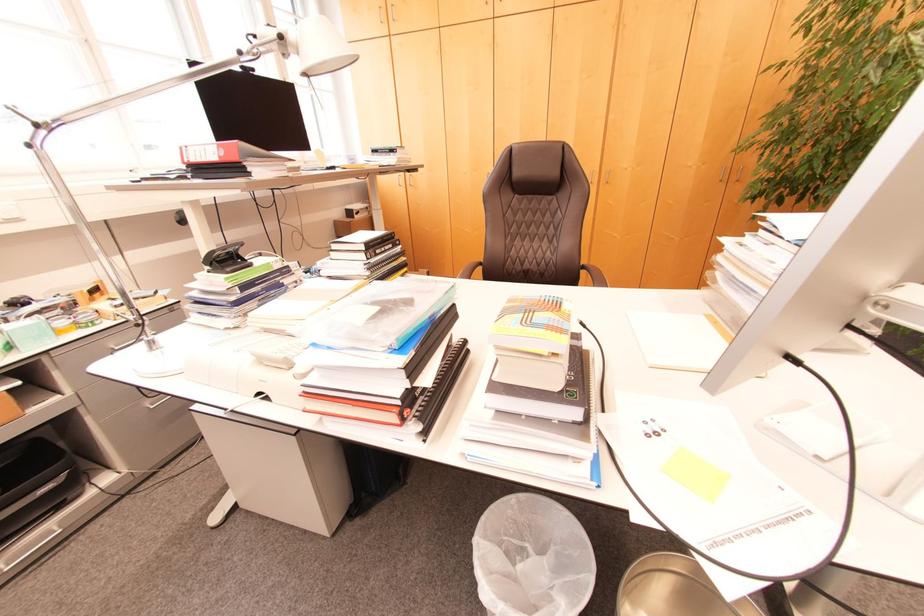
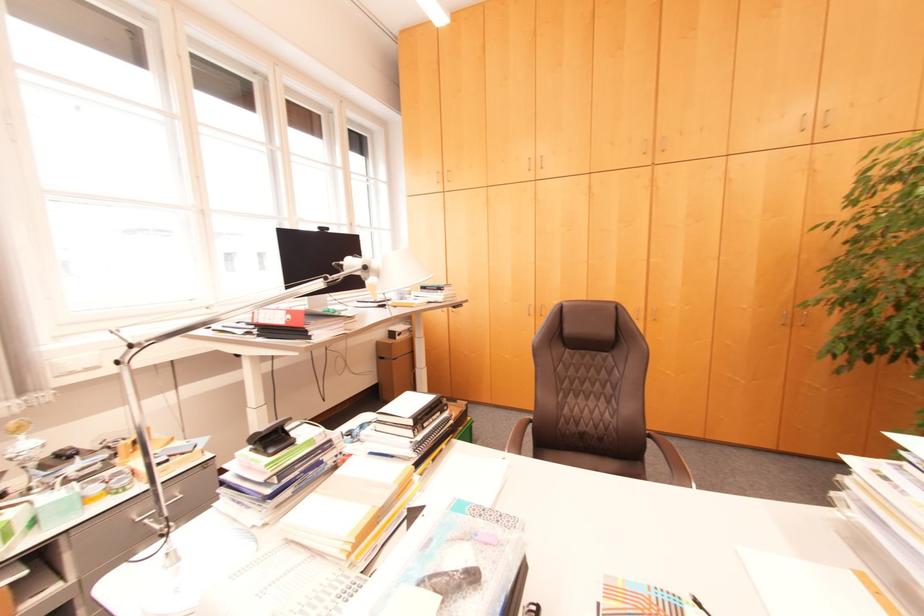
What movement of the cameraman would produce the second image?

The cameraman moved toward left, forward.